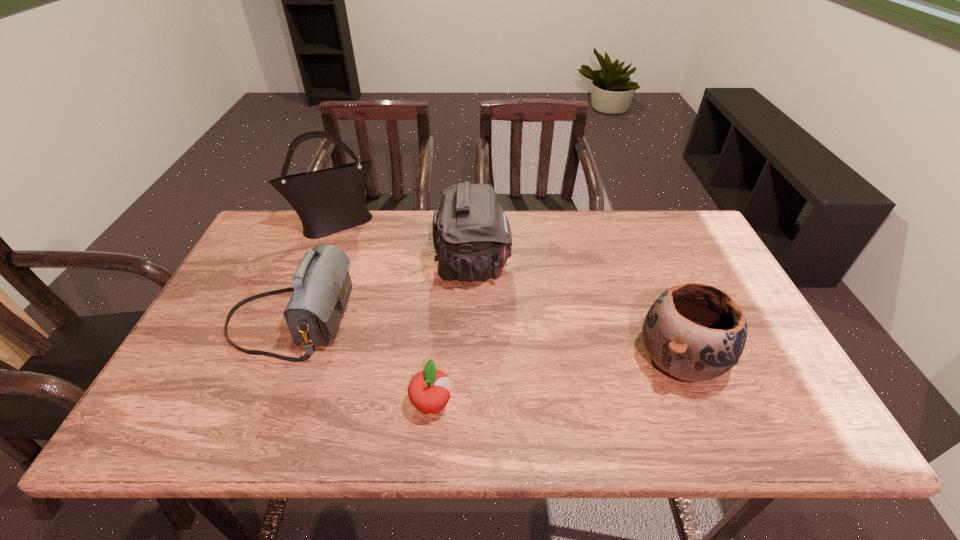
Where is `the second closest object to the second shortest shoulder bag`? This screenshot has height=540, width=960. the second closest object to the second shortest shoulder bag is located at coordinates tap(322, 285).

Point out which object is positioned as the third nearest to the farthest shoulder bag. Please provide its 2D coordinates. Your answer should be formatted as a tuple, i.e. [(x, y)], where the tuple contains the x and y coordinates of a point satisfying the conditions above.

[(427, 390)]

Identify the location of shoulder bag object that ranks as the second closest to the tallest shoulder bag. (322, 285).

Locate an element on the screen. Image resolution: width=960 pixels, height=540 pixels. shoulder bag that is the third closest to the pottery is located at coordinates (328, 201).

The width and height of the screenshot is (960, 540). Find the location of `vacant point that satisfies the following two spatial constraints: 1. on the front side of the shortest shoulder bag; 2. on the right side of the apple`. vacant point that satisfies the following two spatial constraints: 1. on the front side of the shortest shoulder bag; 2. on the right side of the apple is located at coordinates (254, 404).

Where is `free space that satisfies the following two spatial constraints: 1. on the open flap of the second tallest object; 2. on the front side of the apple`? Image resolution: width=960 pixels, height=540 pixels. free space that satisfies the following two spatial constraints: 1. on the open flap of the second tallest object; 2. on the front side of the apple is located at coordinates (470, 404).

Locate an element on the screen. This screenshot has height=540, width=960. free space in the image that satisfies the following two spatial constraints: 1. on the open flap of the rightmost object; 2. on the left side of the rightmost shoulder bag is located at coordinates tap(471, 360).

I want to click on free region that satisfies the following two spatial constraints: 1. on the front side of the farthest shoulder bag; 2. on the left side of the shortest object, so click(x=266, y=404).